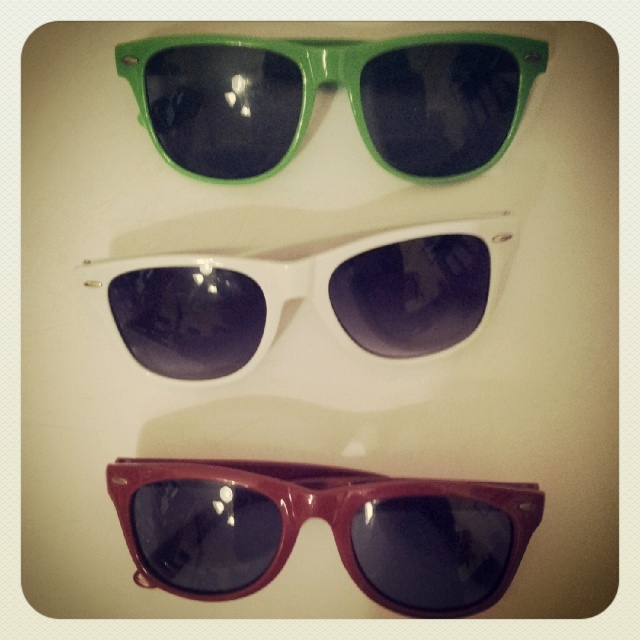
Does glossy burgundy sunglasses at bottom appear on the left side of white glossy sunglasses at center?

No, glossy burgundy sunglasses at bottom is not to the left of white glossy sunglasses at center.

How much distance is there between glossy burgundy sunglasses at bottom and white glossy sunglasses at center?

glossy burgundy sunglasses at bottom and white glossy sunglasses at center are 8.62 inches apart.

Does point (410, 552) come closer to viewer compared to point (316, 292)?

Yes, it is.

The image size is (640, 640). I want to click on glossy burgundy sunglasses at bottom, so click(x=328, y=524).

Between glossy burgundy sunglasses at bottom and green glossy sunglasses at upper center, which one has less height?

Standing shorter between the two is green glossy sunglasses at upper center.

Which is above, glossy burgundy sunglasses at bottom or green glossy sunglasses at upper center?

Positioned higher is green glossy sunglasses at upper center.

Is point (468, 566) more distant than point (483, 150)?

That is True.

Where is `glossy burgundy sunglasses at bottom`? glossy burgundy sunglasses at bottom is located at coordinates (328, 524).

Measure the distance between green glossy sunglasses at upper center and white glossy sunglasses at center.

green glossy sunglasses at upper center and white glossy sunglasses at center are 6.83 inches apart.

Which of these two, green glossy sunglasses at upper center or white glossy sunglasses at center, stands taller?

With more height is white glossy sunglasses at center.

The image size is (640, 640). What do you see at coordinates (333, 83) in the screenshot? I see `green glossy sunglasses at upper center` at bounding box center [333, 83].

You are a GUI agent. You are given a task and a screenshot of the screen. Output one action in this format:
    pyautogui.click(x=<x>, y=<y>)
    Task: Click on the green glossy sunglasses at upper center
    The width and height of the screenshot is (640, 640).
    Given the screenshot: What is the action you would take?
    click(333, 83)